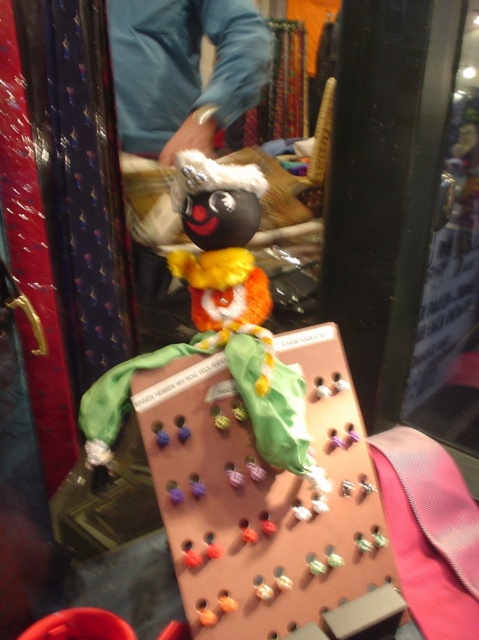
You are a customer in the store and want to place a small earring on the transparent glass at center. However, there is a blue fabric at upper center nearby. Which object should you place the earring on to ensure it is visible to other customers?

You should place the earring on the transparent glass at center because it is positioned to the right of the blue fabric at upper center, making it more visible to customers.

You are a customer in the store and want to place a small earring on either the transparent glass at center or the blue fabric at upper center. Which surface would you choose if you want the earring to be more visible to other customers?

The transparent glass at center is larger in size than blue fabric at upper center, so placing the earring on the transparent glass at center would make it more visible since it has a bigger surface area.